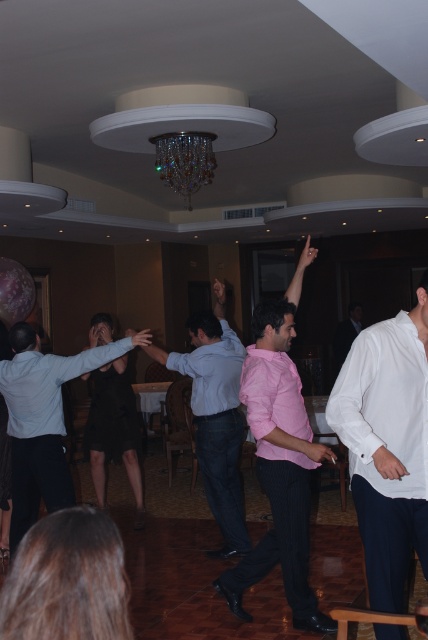
Between point (20, 330) and point (228, 368), which one is positioned in front?

Point (20, 330) is more forward.

Is matte white shirt at center above pink matte shirt at center?

No.

Where is `matte white shirt at center`? Image resolution: width=428 pixels, height=640 pixels. matte white shirt at center is located at coordinates (42, 420).

Does white cotton shirt at right have a larger size compared to pink pinstripe shirt at center?

No, white cotton shirt at right is not bigger than pink pinstripe shirt at center.

In the scene shown: Is white cotton shirt at right below pink pinstripe shirt at center?

Correct, white cotton shirt at right is located below pink pinstripe shirt at center.

Which is behind, point (400, 378) or point (297, 412)?

The point (297, 412) is behind.

In order to click on white cotton shirt at right in this screenshot , I will do coord(388,444).

Does pink matte shirt at center appear under pink satin shirt at center?

Indeed, pink matte shirt at center is positioned under pink satin shirt at center.

Between point (205, 396) and point (341, 362), which one is positioned behind?

Point (341, 362)

The image size is (428, 640). What are the coordinates of `pink matte shirt at center` in the screenshot? It's located at (216, 413).